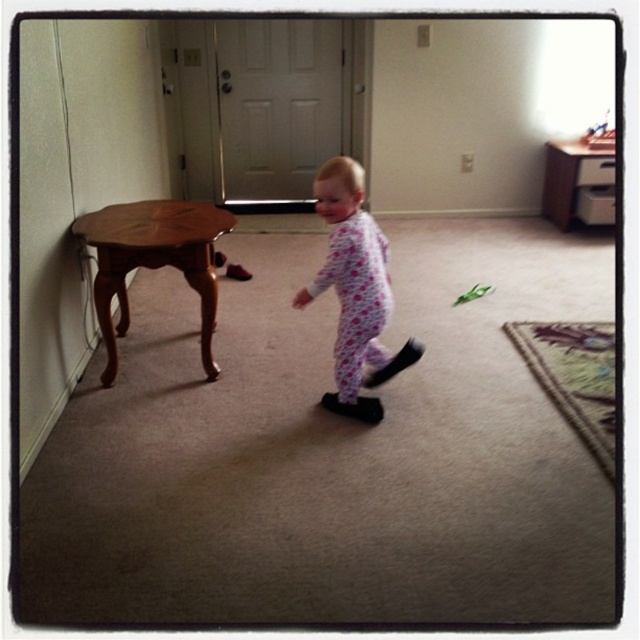
Question: Among these points, which one is farthest from the camera?

Choices:
 (A) (189, 285)
 (B) (461, 292)

Answer: (B)

Question: Is fluffy pink pajamas at center to the right of green plastic toy at center from the viewer's perspective?

Choices:
 (A) yes
 (B) no

Answer: (B)

Question: Can you confirm if fluffy pink pajamas at center is positioned to the right of wooden stool at left?

Choices:
 (A) yes
 (B) no

Answer: (A)

Question: Can you confirm if fluffy pink pajamas at center is wider than green plastic toy at center?

Choices:
 (A) yes
 (B) no

Answer: (A)

Question: Among these objects, which one is nearest to the camera?

Choices:
 (A) green plastic toy at center
 (B) wooden stool at left
 (C) fluffy pink pajamas at center

Answer: (C)

Question: Estimate the real-world distances between objects in this image. Which object is farther from the green plastic toy at center?

Choices:
 (A) fluffy pink pajamas at center
 (B) wooden stool at left

Answer: (B)